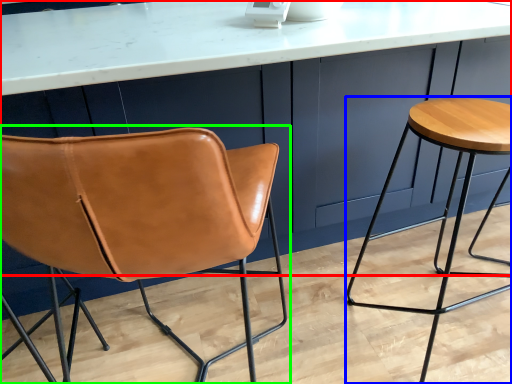
Question: Which object is the farthest from counter (highlighted by a red box)? Choose among these: stool (highlighted by a blue box) or chair (highlighted by a green box).

Choices:
 (A) stool
 (B) chair

Answer: (A)